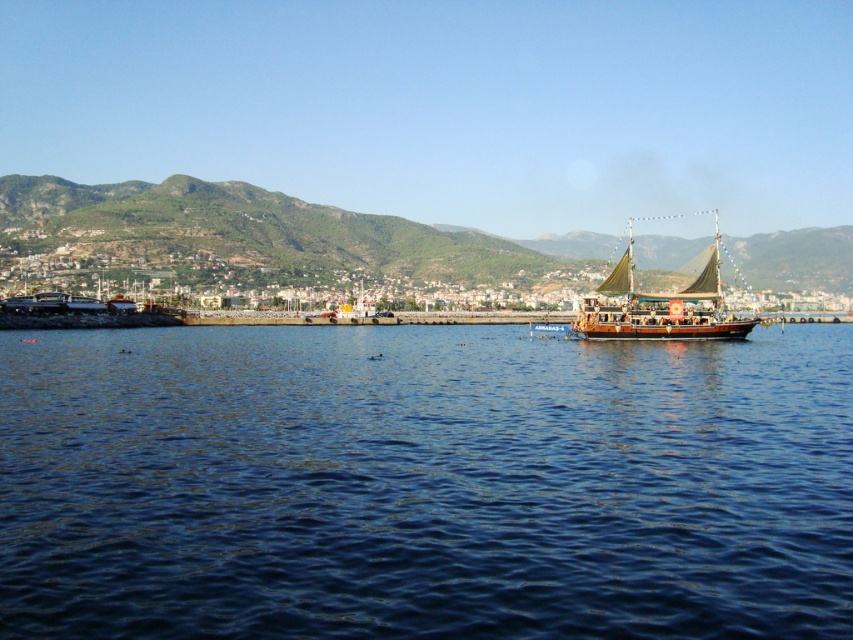
You are a photographer planning to capture the blue water at center and the green textured mountain at upper center in a single shot. Based on their positions, which object should you focus on first to ensure both are in frame?

The blue water at center is to the left of green textured mountain at upper center, so you should focus on the blue water at center first to ensure both are in frame.

You are standing on the shore looking out at the scene. Which object is positioned higher in the image, the blue water at center or the green textured mountain at upper center?

The green textured mountain at upper center is positioned higher in the image than the blue water at center, as it is located above it.

You are a hiker who wants to take a photo of the green textured mountain at upper center. You are currently standing at the shore where the boat is anchored. Which direction should you face to capture the mountain in your photo?

The green textured mountain at upper center is located at point 0.366 on the x axis and 0.300 on the y axis. Since you are at the shore where the boat is anchored, you should face towards the upper center direction to capture the mountain in your photo.